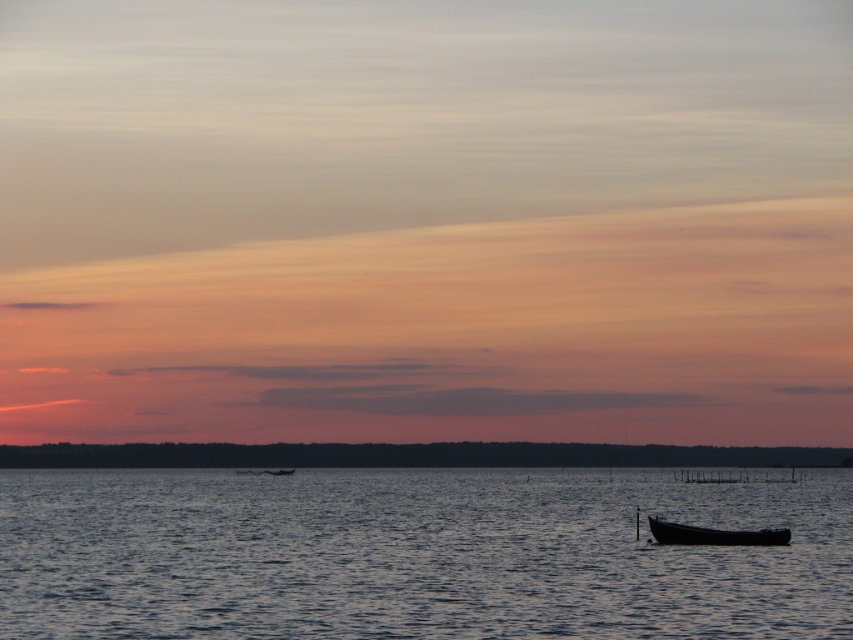
You are standing on the shore and see the dark blue water at lower center and the black matte canoe at lower right. Which object is closer to the horizon?

The dark blue water at lower center is positioned under the black matte canoe at lower right, meaning the canoe is closer to the horizon than the water.

You are a photographer standing at the edge of the water and want to capture both the dark blue water at lower center and the black matte canoe at lower right in a single shot. Which object will occupy more space in the photo?

The dark blue water at lower center is bigger than the black matte canoe at lower right, so it will occupy more space in the photo.

From the picture: You are standing on the shore and want to place both the dark blue water at lower center and the black matte canoe at lower right side by side on a narrow platform. Based on their widths, which object should be placed first to ensure they both fit?

The black matte canoe at lower right is narrower than the dark blue water at lower center. To fit both on the narrow platform, place the black matte canoe at lower right first, followed by the dark blue water at lower center.